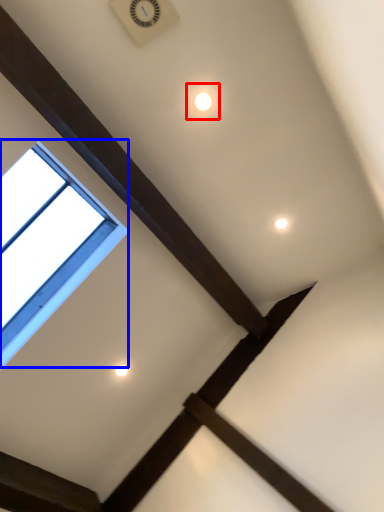
Question: Which object is further to the camera taking this photo, dot (highlighted by a red box) or window (highlighted by a blue box)?

Choices:
 (A) dot
 (B) window

Answer: (A)